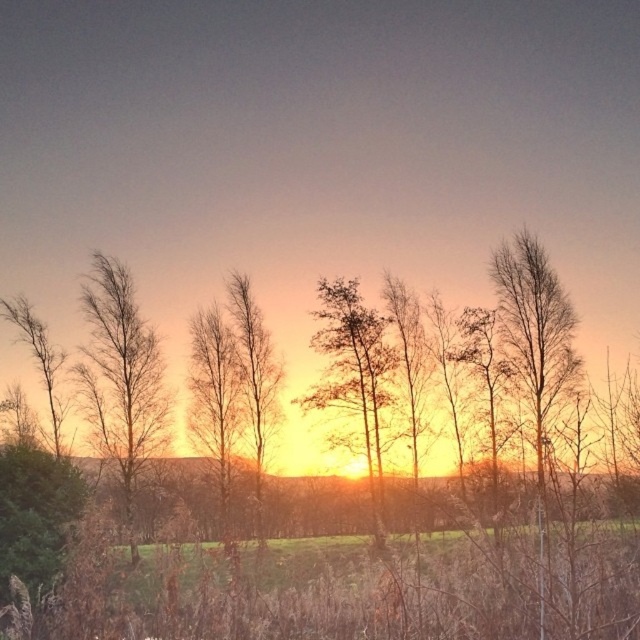
Which is more to the right, bare branches at left or bare branches at center?

Positioned to the right is bare branches at center.

Does point (124, 324) lie behind point (252, 369)?

No, (124, 324) is closer to viewer.

Image resolution: width=640 pixels, height=640 pixels. Describe the element at coordinates (122, 378) in the screenshot. I see `bare branches at left` at that location.

In order to click on bare branches at left in this screenshot , I will do `click(122, 378)`.

Which is in front, point (364, 376) or point (234, 314)?

Point (364, 376)

Is green leafy tree at center thinner than bare branches at center?

Incorrect, green leafy tree at center's width is not less than bare branches at center's.

Measure the distance between green leafy tree at center and camera.

The distance of green leafy tree at center from camera is 27.12 meters.

Where is `green leafy tree at center`? green leafy tree at center is located at coordinates (353, 372).

Is point (81, 369) less distant than point (349, 308)?

That is True.

This screenshot has height=640, width=640. Identify the location of bare branches at left. (122, 378).